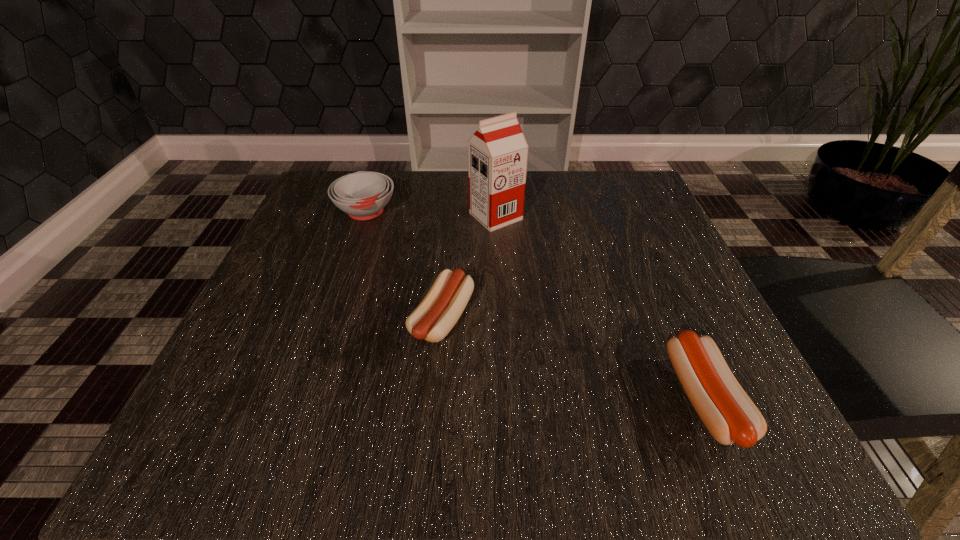
In the image, there is a desktop. Where is `blank space at the near left corner`? Image resolution: width=960 pixels, height=540 pixels. blank space at the near left corner is located at coordinates pyautogui.click(x=169, y=454).

Where is `free spot at the far right corner of the desktop`? free spot at the far right corner of the desktop is located at coordinates (603, 187).

The width and height of the screenshot is (960, 540). What are the coordinates of `free region at the near right corner of the desktop` in the screenshot? It's located at (758, 467).

This screenshot has height=540, width=960. In order to click on vacant space that is in between the soup bowl and the left sausage in this screenshot , I will do `click(404, 266)`.

This screenshot has height=540, width=960. I want to click on free space between the right sausage and the soup bowl, so click(535, 305).

The width and height of the screenshot is (960, 540). In order to click on vacant area that lies between the second tallest object and the tallest object in this screenshot , I will do `click(430, 214)`.

What are the coordinates of `free space between the rightmost object and the soup bowl` in the screenshot? It's located at (535, 305).

This screenshot has width=960, height=540. Find the location of `vacant area that lies between the rightmost object and the leftmost object`. vacant area that lies between the rightmost object and the leftmost object is located at coordinates (535, 305).

The image size is (960, 540). Find the location of `vacant area between the right sausage and the left sausage`. vacant area between the right sausage and the left sausage is located at coordinates (573, 359).

I want to click on free spot between the rightmost object and the leftmost object, so click(x=535, y=305).